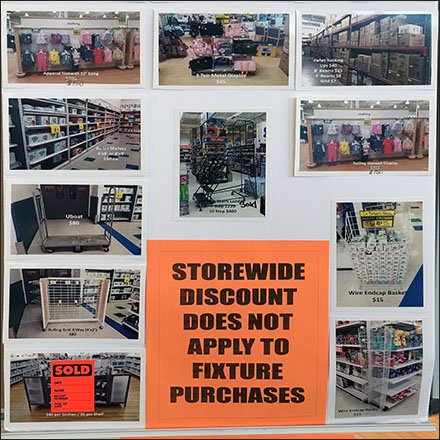
Locate an element on the screen. white wall is located at coordinates (277, 148).